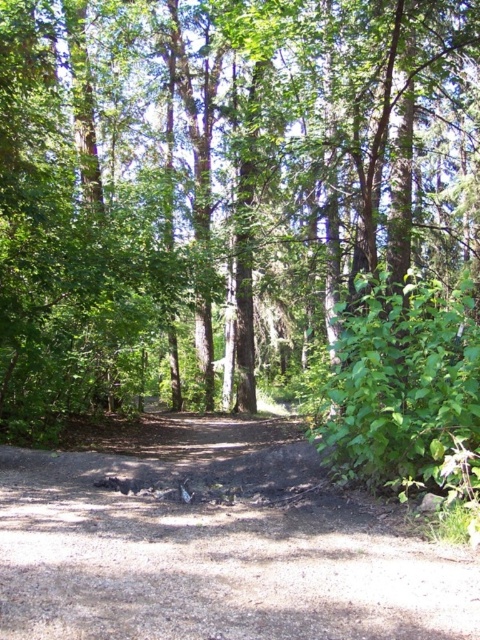
Which is in front, point (233, 189) or point (384, 566)?

Point (384, 566)

Is point (166, 156) positioned after point (274, 545)?

Yes, point (166, 156) is farther from viewer.

Identify the location of green leafy tree at center. This screenshot has width=480, height=640. (217, 188).